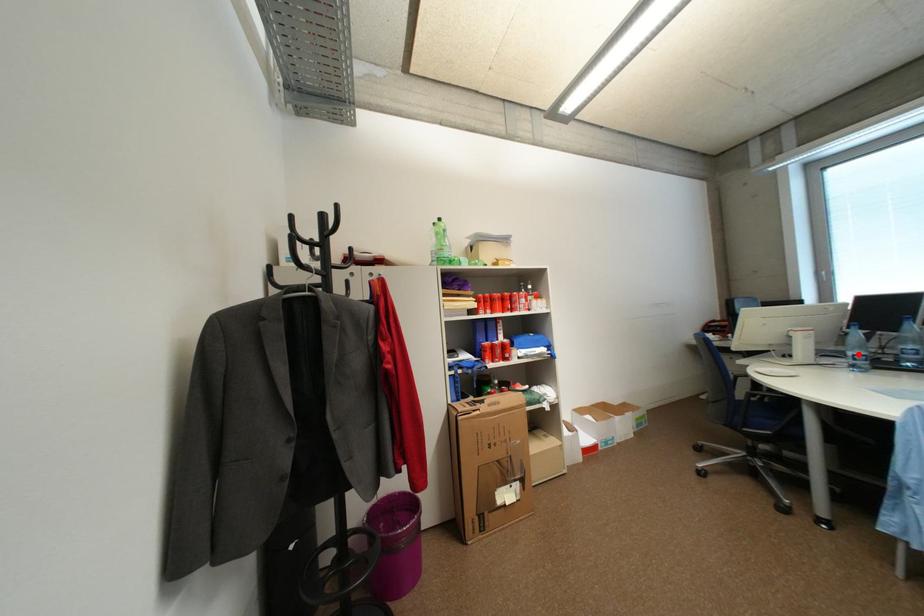
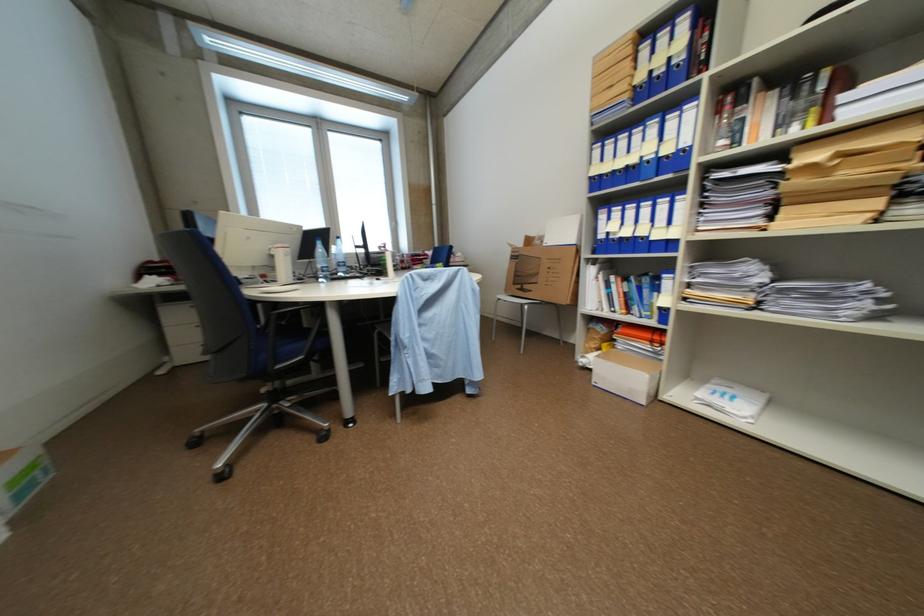
Find the pixel in the second image that matches the highlighted location in the first image.

(327, 267)